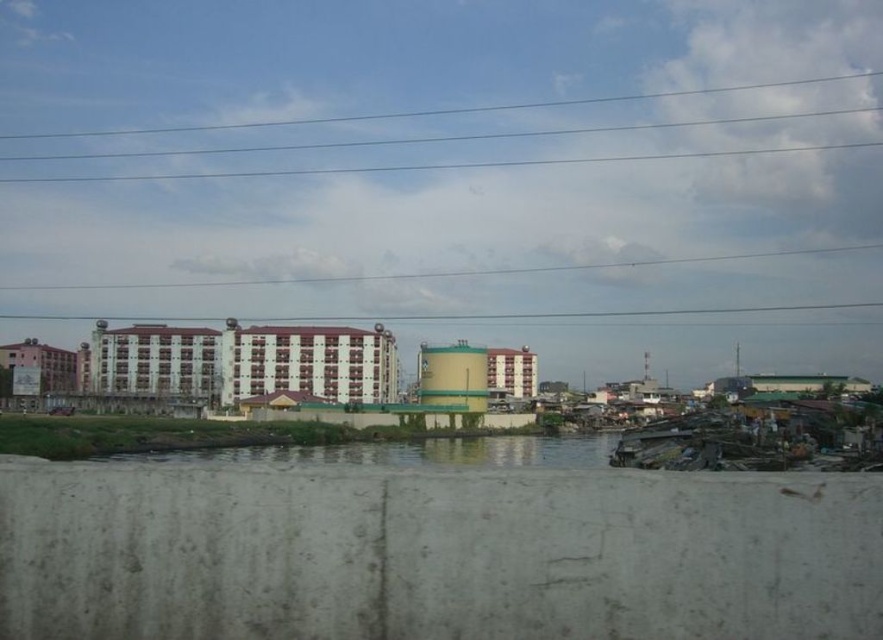
Which is more to the right, white concrete building at center or clear blue wires at upper center?

From the viewer's perspective, clear blue wires at upper center appears more on the right side.

Who is positioned more to the left, white concrete building at center or clear blue wires at upper center?

From the viewer's perspective, white concrete building at center appears more on the left side.

Identify the location of white concrete building at center. (244, 362).

Who is higher up, white concrete building at center or clear water at center?

Positioned higher is white concrete building at center.

Does point (197, 369) come farther from viewer compared to point (548, 445)?

Yes, it is.

Image resolution: width=883 pixels, height=640 pixels. What are the coordinates of `white concrete building at center` in the screenshot? It's located at (244, 362).

Where is `white concrete building at center`? white concrete building at center is located at coordinates (244, 362).

Is clear water at center below clear blue wires at upper center?

Yes.

Find the location of a particular element. clear water at center is located at coordinates (413, 452).

What are the coordinates of `clear water at center` in the screenshot? It's located at (413, 452).